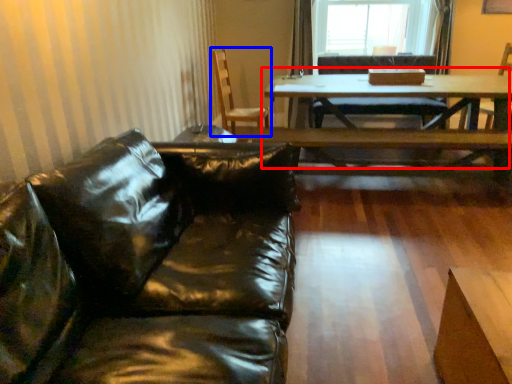
Question: Which of the following is the farthest to the observer, table (highlighted by a red box) or chair (highlighted by a blue box)?

Choices:
 (A) table
 (B) chair

Answer: (B)